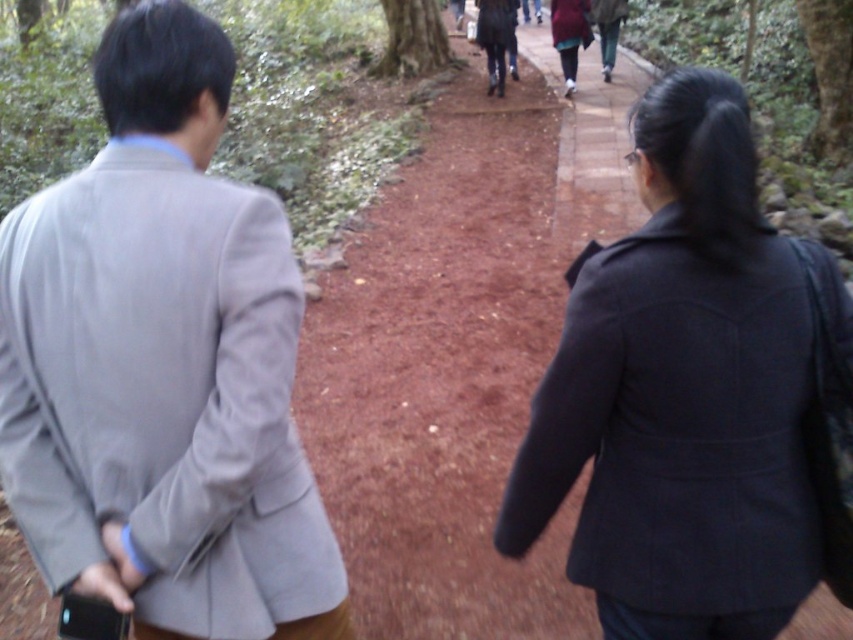
You are a hiker trying to decide which coat to wear for the forest trail. Both the dark red fabric coat at center and the maroon fabric coat at center are available. Which coat has a bigger size?

The dark red fabric coat at center has a larger size compared to the maroon fabric coat at center.

You are a hiker who wants to place a small marker at point (x=161, y=364). According to the image, what object is located at that point?

The light gray suit at left is located at point (x=161, y=364).

You are a photographer trying to capture both the light gray suit at left and the dark red fabric coat at center in a single frame. Which subject should you focus on to ensure both are fully visible without cropping?

The light gray suit at left is wider than the dark red fabric coat at center, so focusing on the light gray suit at left will ensure both subjects are fully visible without cropping.